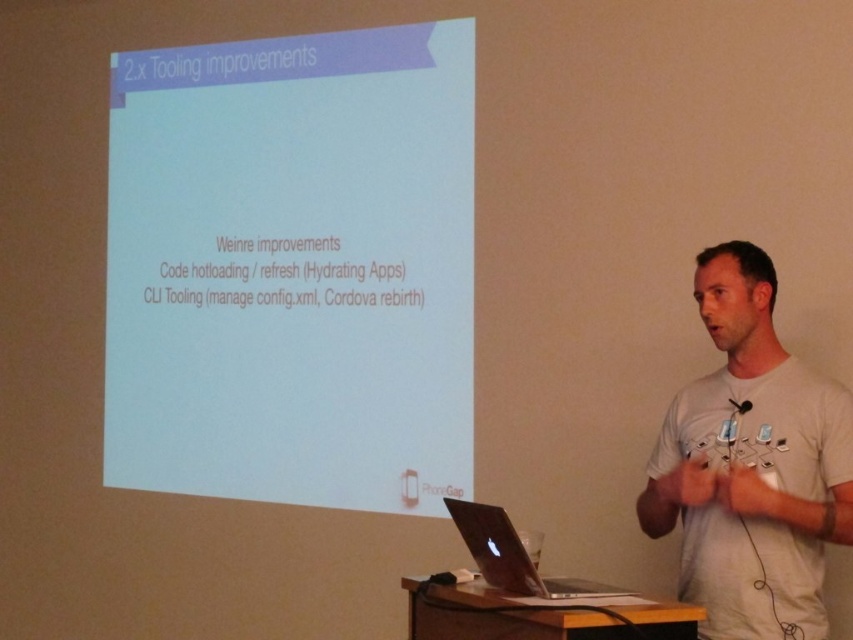
Question: Does white cotton t-shirt at center appear over silver metallic laptop at center?

Choices:
 (A) yes
 (B) no

Answer: (A)

Question: Which point appears farthest from the camera in this image?

Choices:
 (A) (798, 381)
 (B) (519, 545)
 (C) (132, 182)

Answer: (C)

Question: Which point is closer to the camera taking this photo?

Choices:
 (A) (486, 524)
 (B) (212, 284)

Answer: (A)

Question: Does white matte projector screen at upper center have a lesser width compared to silver metallic laptop at center?

Choices:
 (A) yes
 (B) no

Answer: (B)

Question: Can you confirm if white matte projector screen at upper center is positioned below white cotton t-shirt at center?

Choices:
 (A) yes
 (B) no

Answer: (B)

Question: Which of the following is the farthest from the observer?

Choices:
 (A) (611, 589)
 (B) (704, 602)
 (C) (466, 168)

Answer: (C)